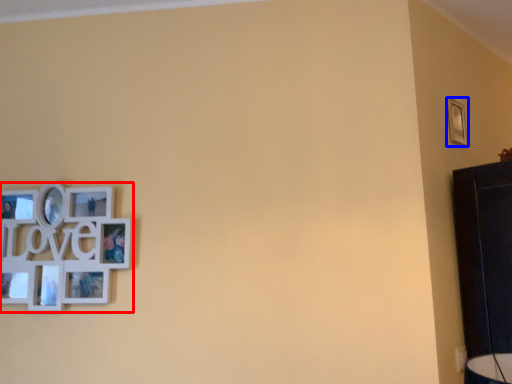
Question: Which object appears closest to the camera in this image, picture frame (highlighted by a red box) or picture frame (highlighted by a blue box)?

Choices:
 (A) picture frame
 (B) picture frame

Answer: (A)